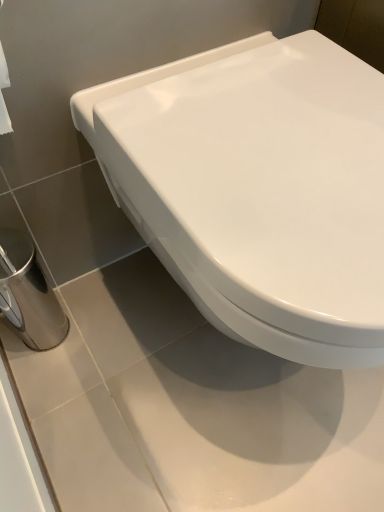
At what (x,y) coordinates should I click in order to perform the action: click on free space above white glossy toilet at center (from a real-world perspective). Please return your answer as a coordinate pair (x, y). The image size is (384, 512). Looking at the image, I should click on (286, 130).